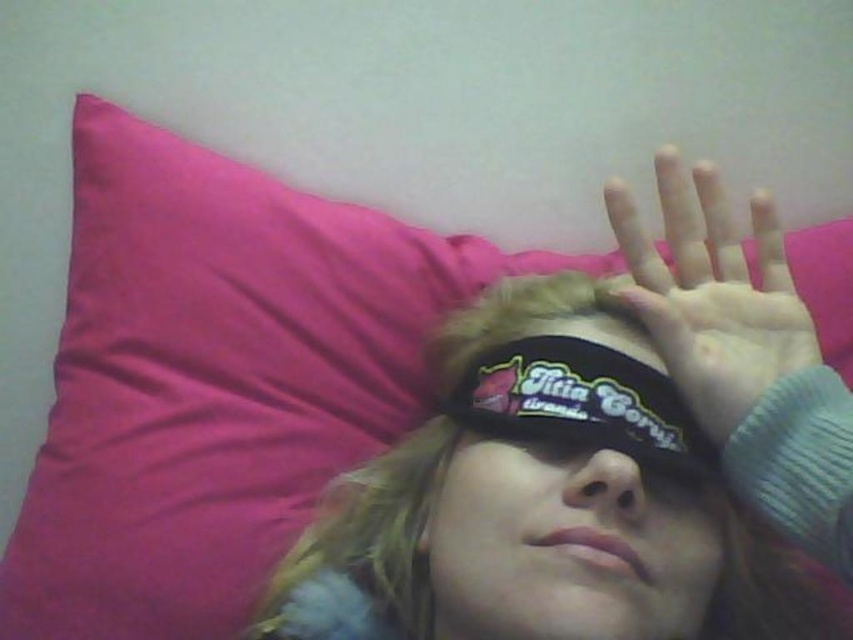
Consider the image. You are a fashion designer analyzing the image. You need to determine if the matte black hand at upper right can fully cover the black fabric eye mask at center without overlapping any other objects. Based on their sizes, can it be done?

The matte black hand at upper right is narrower than the black fabric eye mask at center, so it cannot fully cover the mask without overlapping other objects.

You are a delivery robot that needs to deliver a package to the person lying on the bright pink pillow. The package must be placed precisely between the black fabric blindfold at center and the matte black hand at upper right. What is the minimum distance the robot should maintain between the two objects to ensure the package fits?

The black fabric blindfold at center and the matte black hand at upper right are 4.29 inches apart, so the robot should ensure the package is placed within this distance to fit between them.

You are a detective analyzing the scene. The black fabric blindfold at center and the matte black hand at upper right are both in the image. Which object is larger in height?

The black fabric blindfold at center is much taller than the matte black hand at upper right, so the blindfold is larger in height.